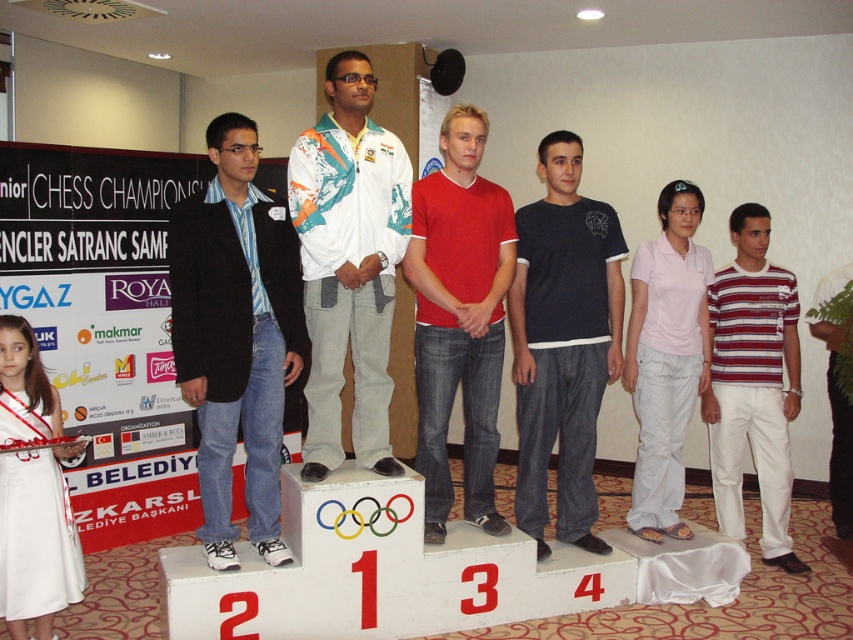
Question: Does matte black blazer at center have a greater width compared to striped cotton t-shirt at right?

Choices:
 (A) no
 (B) yes

Answer: (A)

Question: Which of the following is the farthest from the observer?

Choices:
 (A) (323, 90)
 (B) (759, 387)
 (C) (242, 204)
 (D) (425, 540)

Answer: (A)

Question: Is matte black blazer at center thinner than white fabric jacket at center?

Choices:
 (A) no
 (B) yes

Answer: (A)

Question: Which of the following is the farthest from the observer?

Choices:
 (A) dark blue cotton t-shirt at center
 (B) matte black blazer at center
 (C) white fabric jacket at center

Answer: (A)

Question: Can you confirm if white fabric jacket at center is positioned above striped cotton t-shirt at right?

Choices:
 (A) no
 (B) yes

Answer: (B)

Question: Which point is farther to the camera?

Choices:
 (A) pos(479,161)
 (B) pos(178,262)
 (C) pos(364,388)
 (D) pos(584,428)

Answer: (D)